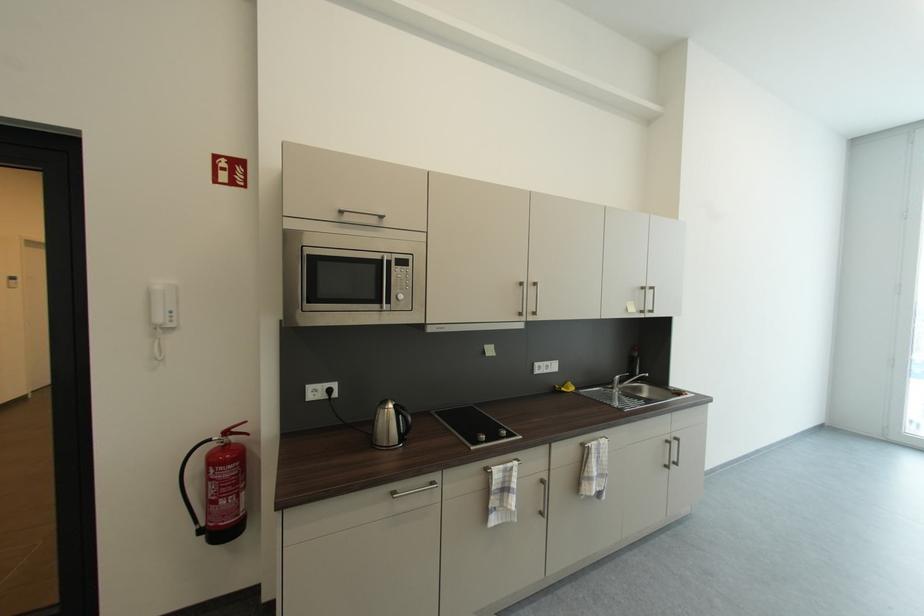
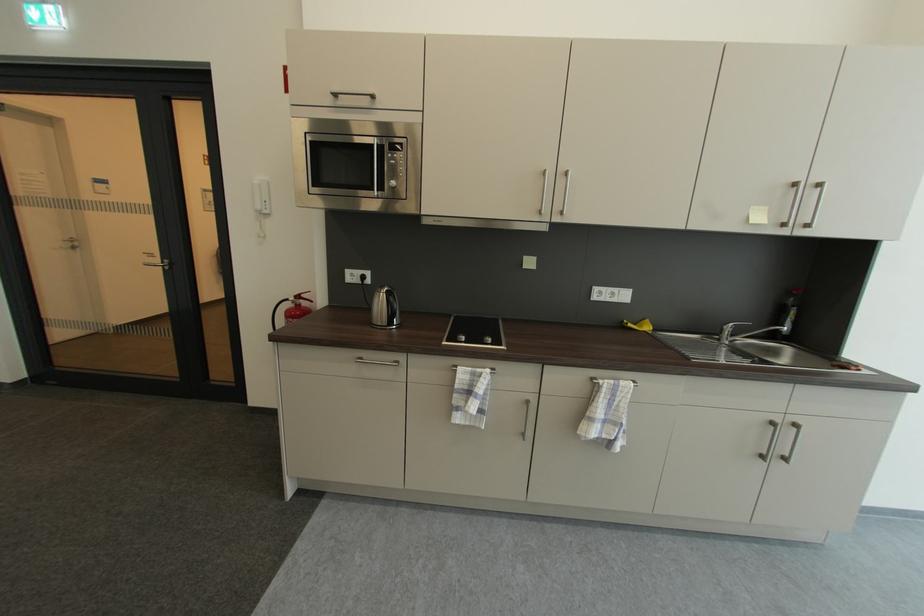
Where in the second image is the point corresponding to (505,434) from the first image?

(490, 339)